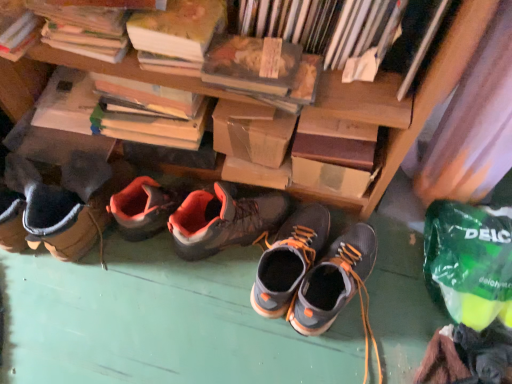
Find the location of a particular element. vacant region in front of orange suede hiking boots at center, positioned as the third footwear in right-to-left order is located at coordinates (214, 311).